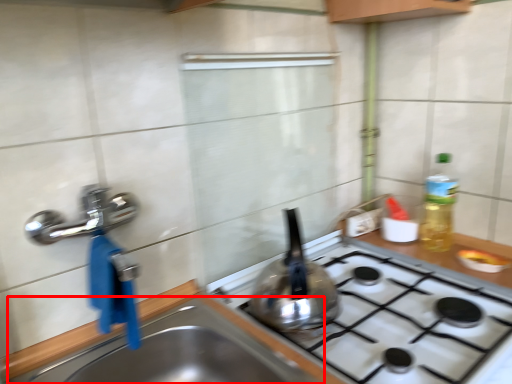
Question: In this image, where is sink (annotated by the red box) located relative to kitchen appliance?

Choices:
 (A) right
 (B) left

Answer: (B)